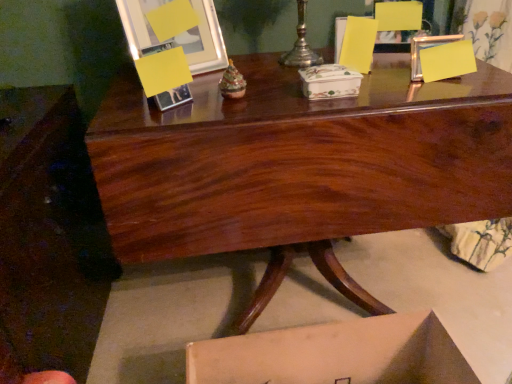
The height and width of the screenshot is (384, 512). Find the location of `vacant space to the left of silver metallic candle holder at upper center`. vacant space to the left of silver metallic candle holder at upper center is located at coordinates (246, 64).